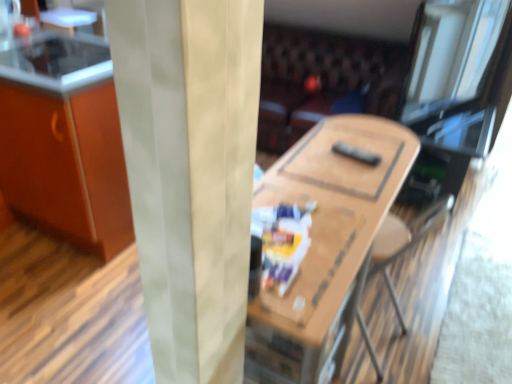
Question: Should I look upward or downward to see wooden table at center?

Choices:
 (A) up
 (B) down

Answer: (B)

Question: Should I look upward or downward to see smooth glass counter top at upper left?

Choices:
 (A) up
 (B) down

Answer: (A)

Question: From a real-world perspective, is wooden table at center over orange matte cabinet at left?

Choices:
 (A) no
 (B) yes

Answer: (A)

Question: Does wooden table at center have a lesser width compared to orange matte cabinet at left?

Choices:
 (A) yes
 (B) no

Answer: (A)

Question: Could you tell me if wooden table at center is facing orange matte cabinet at left?

Choices:
 (A) no
 (B) yes

Answer: (A)

Question: Is wooden table at center turned away from orange matte cabinet at left?

Choices:
 (A) no
 (B) yes

Answer: (B)

Question: Is the surface of wooden table at center in direct contact with orange matte cabinet at left?

Choices:
 (A) no
 (B) yes

Answer: (A)

Question: Is wooden table at center not close to orange matte cabinet at left?

Choices:
 (A) yes
 (B) no

Answer: (A)

Question: Is orange matte cabinet at left closer to camera compared to smooth glass counter top at upper left?

Choices:
 (A) no
 (B) yes

Answer: (B)

Question: Can you confirm if orange matte cabinet at left is thinner than smooth glass counter top at upper left?

Choices:
 (A) yes
 (B) no

Answer: (B)

Question: Does orange matte cabinet at left have a smaller size compared to smooth glass counter top at upper left?

Choices:
 (A) no
 (B) yes

Answer: (A)

Question: Is smooth glass counter top at upper left at the back of orange matte cabinet at left?

Choices:
 (A) no
 (B) yes

Answer: (A)

Question: Does orange matte cabinet at left touch smooth glass counter top at upper left?

Choices:
 (A) no
 (B) yes

Answer: (A)

Question: Is orange matte cabinet at left taller than smooth glass counter top at upper left?

Choices:
 (A) yes
 (B) no

Answer: (A)

Question: Can you confirm if leather couch at center is taller than orange matte cabinet at left?

Choices:
 (A) yes
 (B) no

Answer: (B)